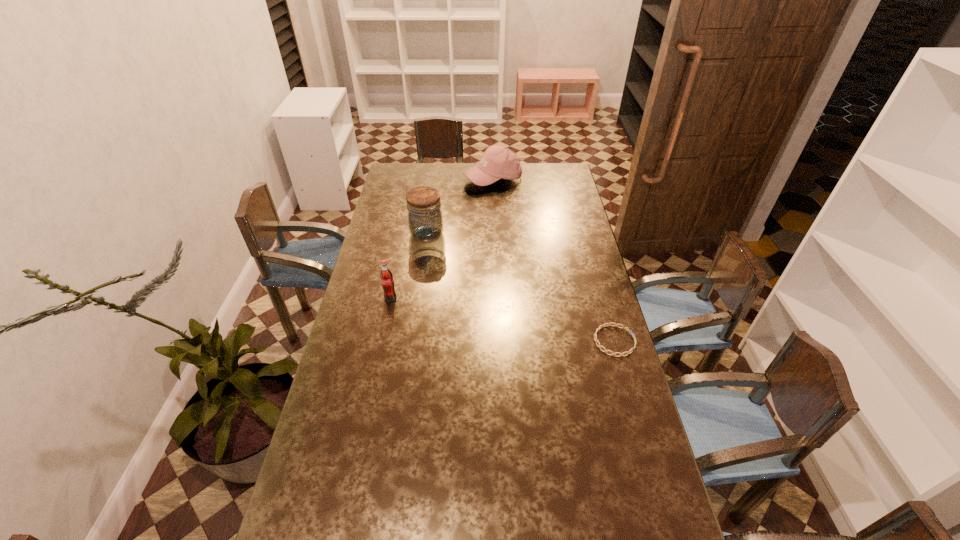
This screenshot has width=960, height=540. In order to click on unoccupied position between the leftmost object and the second farthest object in this screenshot , I will do pos(409,266).

The width and height of the screenshot is (960, 540). Find the location of `unoccupied position between the third object from left to right and the jar`. unoccupied position between the third object from left to right and the jar is located at coordinates tap(460, 207).

Locate an element on the screen. This screenshot has width=960, height=540. vacant region between the rightmost object and the baseball cap is located at coordinates (554, 260).

Where is `free space that is in between the third farthest object and the bracelet`? Image resolution: width=960 pixels, height=540 pixels. free space that is in between the third farthest object and the bracelet is located at coordinates (502, 319).

Locate an element on the screen. free spot between the jar and the baseball cap is located at coordinates (460, 207).

Identify the location of object that is the second closest to the third object from right to left. Image resolution: width=960 pixels, height=540 pixels. (386, 276).

The height and width of the screenshot is (540, 960). I want to click on the second closest object to the bracelet, so (x=386, y=276).

The image size is (960, 540). Find the location of `free spot that satisfies the following two spatial constraints: 1. on the label of the shortest object; 2. on the surface of the soda bottle showing star-shaped elements`. free spot that satisfies the following two spatial constraints: 1. on the label of the shortest object; 2. on the surface of the soda bottle showing star-shaped elements is located at coordinates (381, 341).

Find the location of a particular element. The image size is (960, 540). vacant space that satisfies the following two spatial constraints: 1. on the label of the bracelet; 2. on the surface of the leftmost object showing star-shaped elements is located at coordinates (381, 341).

Find the location of a particular element. free space that satisfies the following two spatial constraints: 1. on the label of the third farthest object; 2. on the surface of the bracelet showing star-shaped elements is located at coordinates (381, 341).